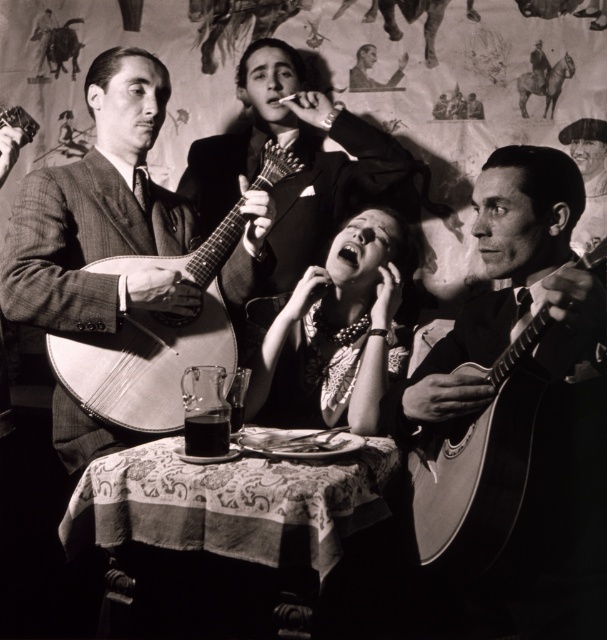
You are standing in front of the two guitarists. Which guitarist is closer to you? The one at point (348, 365) or the one at point (469, 512)?

The guitarist at point (469, 512) is closer to you because point (348, 365) is behind point (469, 512).

You are standing 5 feet away from the point at coordinates point [415,476]. Can you reach the point without moving closer?

The point at coordinates point [415,476] is 6.02 feet away from the viewer. Since you are already standing 5 feet away, you are close enough to reach it without needing to move closer.

Based on the scene description, where is the matte black necklace at center located in the image?

The matte black necklace at center is located at point [333,332] in the image.